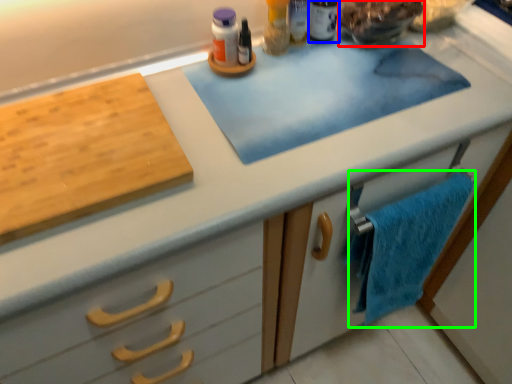
Question: Considering the real-world distances, which object is farthest from food (highlighted by a red box)? toiletry (highlighted by a blue box) or bath towel (highlighted by a green box)?

Choices:
 (A) toiletry
 (B) bath towel

Answer: (B)